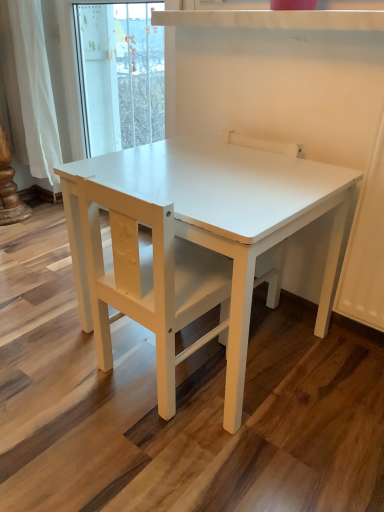
What do you see at coordinates (264, 144) in the screenshot? Image resolution: width=384 pixels, height=512 pixels. I see `white matte chair at center` at bounding box center [264, 144].

Locate an element on the screen. white matte chair at center is located at coordinates (x=264, y=144).

What is the approximate width of white matte chair at center?

It is 12.85 inches.

Locate an element on the screen. The width and height of the screenshot is (384, 512). white matte table at center is located at coordinates (195, 243).

The height and width of the screenshot is (512, 384). What do you see at coordinates (195, 243) in the screenshot?
I see `white matte table at center` at bounding box center [195, 243].

Where is `white matte chair at center`? The width and height of the screenshot is (384, 512). white matte chair at center is located at coordinates (264, 144).

Visually, is white matte table at center positioned to the left or to the right of white matte chair at center?

Clearly, white matte table at center is on the left of white matte chair at center in the image.

From the picture: Relative to white matte chair at center, is white matte table at center in front or behind?

In the image, white matte table at center appears in front of white matte chair at center.

Which is further, (145, 312) or (242, 144)?

Positioned behind is point (242, 144).

From the image's perspective, which object appears higher, white matte table at center or white matte chair at center?

white matte chair at center, from the image's perspective.

From a real-world perspective, which is physically below, white matte table at center or white matte chair at center?

From a 3D spatial view, white matte table at center is below.

Can you confirm if white matte table at center is wider than white matte chair at center?

Yes, white matte table at center is wider than white matte chair at center.

Can you confirm if white matte table at center is shorter than white matte chair at center?

Indeed, white matte table at center has a lesser height compared to white matte chair at center.

Between white matte table at center and white matte chair at center, which one has larger size?

white matte table at center is bigger.

Would you say white matte table at center is outside white matte chair at center?

Absolutely, white matte table at center is external to white matte chair at center.

Is there a large distance between white matte table at center and white matte chair at center?

No.

Could you tell me if white matte table at center is turned towards white matte chair at center?

Yes, white matte table at center is facing white matte chair at center.

How distant is white matte table at center from white matte chair at center?

They are 15.11 inches apart.

What are the coordinates of `chair above the white matte table at center (from the image's perspective)` in the screenshot? It's located at (264, 144).

Which is more to the right, white matte chair at center or white matte table at center?

Positioned to the right is white matte chair at center.

Is white matte chair at center positioned behind white matte table at center?

Yes, it is.

Does point (262, 146) come farther from viewer compared to point (129, 310)?

Yes, point (262, 146) is behind point (129, 310).

Consider the image. From the image's perspective, is white matte chair at center under white matte table at center?

Incorrect, from the image's perspective, white matte chair at center is higher than white matte table at center.

From a real-world perspective, does white matte chair at center sit lower than white matte table at center?

No.

Which object is wider, white matte chair at center or white matte table at center?

Wider between the two is white matte table at center.

Considering the sizes of objects white matte chair at center and white matte table at center in the image provided, who is shorter, white matte chair at center or white matte table at center?

white matte table at center.

Does white matte chair at center have a larger size compared to white matte table at center?

No, white matte chair at center is not bigger than white matte table at center.

Could white matte table at center be considered to be inside white matte chair at center?

No, white matte table at center is not a part of white matte chair at center.

Is white matte chair at center with white matte table at center?

No, white matte chair at center is not next to white matte table at center.

Is white matte chair at center oriented towards white matte table at center?

Yes, white matte chair at center is oriented towards white matte table at center.

How different are the orientations of white matte chair at center and white matte table at center in degrees?

0.281 degrees separate the facing orientations of white matte chair at center and white matte table at center.

Where is `table below the white matte chair at center (from the image's perspective)`? table below the white matte chair at center (from the image's perspective) is located at coordinates (195, 243).

Find the location of a particular element. This screenshot has height=512, width=384. table in front of the white matte chair at center is located at coordinates (195, 243).

This screenshot has width=384, height=512. In the image, there is a white matte chair at center. Find the location of `table below it (from a real-world perspective)`. table below it (from a real-world perspective) is located at coordinates (195, 243).